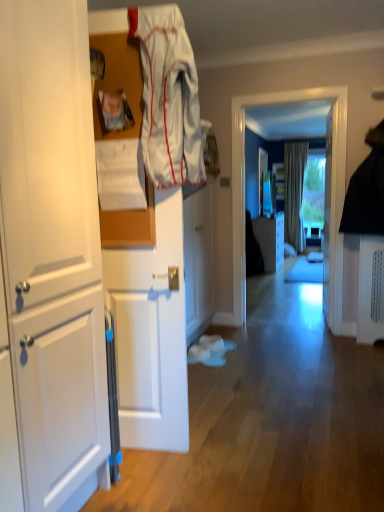
Image resolution: width=384 pixels, height=512 pixels. Describe the element at coordinates (270, 240) in the screenshot. I see `matte white cabinet at center, acting as the 1th cabinetry starting from the back` at that location.

You are a GUI agent. You are given a task and a screenshot of the screen. Output one action in this format:
    pyautogui.click(x=<x>, y=<y>)
    Task: Click on the white matte cabinet at left, the 3th cabinetry viewed from the right
    This screenshot has width=384, height=512.
    Given the screenshot: What is the action you would take?
    pyautogui.click(x=52, y=249)

What do you see at coordinates (332, 216) in the screenshot?
I see `transparent glass window at center` at bounding box center [332, 216].

What is the approximate height of beige textured curtain at center?

beige textured curtain at center is 7.22 feet tall.

What is the approximate width of white glossy door at center?

9.51 centimeters.

Where is `matte white cabinet at center, the third cabinetry from the front`? The height and width of the screenshot is (512, 384). matte white cabinet at center, the third cabinetry from the front is located at coordinates (270, 240).

Considering the relative sizes of white matte cabinet at center, the 2th cabinetry when ordered from back to front, and white paper at upper center in the image provided, is white matte cabinet at center, the 2th cabinetry when ordered from back to front, bigger than white paper at upper center?

Indeed, white matte cabinet at center, the 2th cabinetry when ordered from back to front, has a larger size compared to white paper at upper center.

Looking at this image, does white matte cabinet at center, which is the second cabinetry in left-to-right order, appear on the left side of white paper at upper center?

In fact, white matte cabinet at center, which is the second cabinetry in left-to-right order, is to the right of white paper at upper center.

Considering the positions of points (196, 276) and (129, 212), is point (196, 276) closer to camera compared to point (129, 212)?

That is False.

Is white matte cabinet at center, which is the second cabinetry in left-to-right order, further to the viewer compared to white paper at upper center?

Yes, white matte cabinet at center, which is the second cabinetry in left-to-right order, is further from the viewer.

In the scene shown: Is matte white cabinet at center, which ranks as the 3th cabinetry in left-to-right order, at the back of white paper at upper center?

Yes, white paper at upper center is facing away from matte white cabinet at center, which ranks as the 3th cabinetry in left-to-right order.

Considering the relative sizes of white paper at upper center and matte white cabinet at center, placed as the first cabinetry when sorted from right to left, in the image provided, is white paper at upper center thinner than matte white cabinet at center, placed as the first cabinetry when sorted from right to left,?

Correct, the width of white paper at upper center is less than that of matte white cabinet at center, placed as the first cabinetry when sorted from right to left.

Is white paper at upper center surrounding matte white cabinet at center, which ranks as the 3th cabinetry in left-to-right order?

No, white paper at upper center does not contain matte white cabinet at center, which ranks as the 3th cabinetry in left-to-right order.

Does point (150, 234) come closer to viewer compared to point (267, 262)?

Yes, point (150, 234) is in front of point (267, 262).

Is white matte cabinet at left, the 1th cabinetry when ordered from left to right, bigger than white glossy door at center?

Correct, white matte cabinet at left, the 1th cabinetry when ordered from left to right, is larger in size than white glossy door at center.

How different are the orientations of white matte cabinet at left, the 1th cabinetry when ordered from left to right, and white glossy door at center in degrees?

The angular difference between white matte cabinet at left, the 1th cabinetry when ordered from left to right, and white glossy door at center is 85.8 degrees.

Considering the sizes of objects white matte cabinet at left, the 3th cabinetry viewed from the right, and white glossy door at center in the image provided, who is thinner, white matte cabinet at left, the 3th cabinetry viewed from the right, or white glossy door at center?

white glossy door at center.

Is white matte cabinet at left, placed as the 1th cabinetry when sorted from front to back, next to beige textured curtain at center?

white matte cabinet at left, placed as the 1th cabinetry when sorted from front to back, and beige textured curtain at center are clearly separated.

Between white matte cabinet at left, marked as the 3th cabinetry in a back-to-front arrangement, and beige textured curtain at center, which one has more height?

Standing taller between the two is beige textured curtain at center.

Between point (55, 49) and point (290, 173), which one is positioned behind?

The point (290, 173) is more distant.

Considering the relative sizes of white matte cabinet at left, placed as the 1th cabinetry when sorted from front to back, and beige textured curtain at center in the image provided, is white matte cabinet at left, placed as the 1th cabinetry when sorted from front to back, smaller than beige textured curtain at center?

Yes.

Is white matte cabinet at center, the second cabinetry from the right, aimed at white fabric at upper center?

No, white matte cabinet at center, the second cabinetry from the right, does not turn towards white fabric at upper center.

Does white matte cabinet at center, the second cabinetry from the right, have a greater width compared to white fabric at upper center?

No, white matte cabinet at center, the second cabinetry from the right, is not wider than white fabric at upper center.

Is beige textured curtain at center looking in the opposite direction of white paper at upper center?

That's not correct — beige textured curtain at center is not looking away from white paper at upper center.

From the image's perspective, is beige textured curtain at center located above white paper at upper center?

Yes.

Consider the image. Which is further, (286, 224) or (148, 228)?

Point (286, 224)

From the image's perspective, does matte plastic photo frame at upper left appear lower than white paper at upper center?

No.

How different are the orientations of matte plastic photo frame at upper left and white paper at upper center in degrees?

The angular difference between matte plastic photo frame at upper left and white paper at upper center is 0.0021 degrees.

Looking at this image, can you confirm if matte plastic photo frame at upper left is positioned to the left of white paper at upper center?

Yes, matte plastic photo frame at upper left is to the left of white paper at upper center.

The image size is (384, 512). I want to click on wide in front of the white matte cabinet at center, the second cabinetry from the right, so click(x=130, y=225).

Where is `cabinetry that is the 2nd one when counting rightward from the white paper at upper center`? The image size is (384, 512). cabinetry that is the 2nd one when counting rightward from the white paper at upper center is located at coordinates (270, 240).

When comparing their distances from white matte cabinet at left, the 1th cabinetry when ordered from left to right, does white matte cabinet at center, the second cabinetry from the right, or white paper at upper center seem further?

white matte cabinet at center, the second cabinetry from the right, lies further to white matte cabinet at left, the 1th cabinetry when ordered from left to right, than the other object.

Estimate the real-world distances between objects in this image. Which object is closer to beige textured curtain at center, white fabric at upper center or white matte cabinet at left, the 3th cabinetry viewed from the right?

Based on the image, white fabric at upper center appears to be nearer to beige textured curtain at center.

Which object lies further to the anchor point white fabric at upper center, white paper at upper center or transparent glass window at center?

Based on the image, transparent glass window at center appears to be further to white fabric at upper center.

Based on their spatial positions, is transparent glass window at center or white matte cabinet at left, placed as the 1th cabinetry when sorted from front to back, further from white matte cabinet at center, the second cabinetry viewed from the front?

white matte cabinet at left, placed as the 1th cabinetry when sorted from front to back, is positioned further to the anchor white matte cabinet at center, the second cabinetry viewed from the front.

When comparing their distances from white glossy door at center, does white matte cabinet at left, placed as the 1th cabinetry when sorted from front to back, or white matte cabinet at center, the second cabinetry viewed from the front, seem closer?

white matte cabinet at center, the second cabinetry viewed from the front.

When comparing their distances from white matte cabinet at center, the second cabinetry from the right, does white matte cabinet at left, marked as the 3th cabinetry in a back-to-front arrangement, or white fabric at upper center seem further?

white matte cabinet at left, marked as the 3th cabinetry in a back-to-front arrangement, lies further to white matte cabinet at center, the second cabinetry from the right, than the other object.

Considering their positions, is beige textured curtain at center positioned closer to white paper at upper center than matte white cabinet at center, placed as the first cabinetry when sorted from right to left?

Based on the image, matte white cabinet at center, placed as the first cabinetry when sorted from right to left, appears to be nearer to white paper at upper center.

From the image, which object appears to be farther from matte white cabinet at center, the third cabinetry from the front, white matte cabinet at left, the 3th cabinetry viewed from the right, or white glossy door at center?

Among the two, white matte cabinet at left, the 3th cabinetry viewed from the right, is located further to matte white cabinet at center, the third cabinetry from the front.

Locate an element on the screen. The image size is (384, 512). wide between white matte cabinet at left, marked as the 3th cabinetry in a back-to-front arrangement, and white glossy door at center in the front-back direction is located at coordinates (130, 225).

The image size is (384, 512). What are the coordinates of `window screen between white matte cabinet at center, the 2th cabinetry when ordered from back to front, and matte white cabinet at center, acting as the 1th cabinetry starting from the back, from front to back` in the screenshot? It's located at (332, 216).

At what (x,y) coordinates should I click in order to perform the action: click on window screen between white matte cabinet at center, which is the second cabinetry in left-to-right order, and white glossy door at center, in the horizontal direction. Please return your answer as a coordinate pair (x, y). The image size is (384, 512). Looking at the image, I should click on 332,216.

Locate an element on the screen. wide between white matte cabinet at left, the 1th cabinetry when ordered from left to right, and white matte cabinet at center, the 2th cabinetry when ordered from back to front, in the front-back direction is located at coordinates pyautogui.click(x=130, y=225).